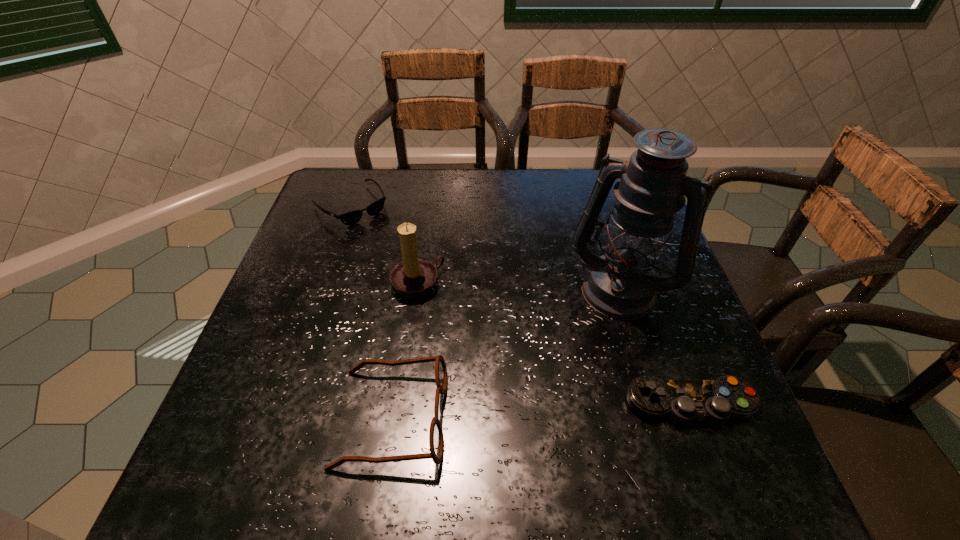
Where is `free space that is in between the control and the spectacles`? free space that is in between the control and the spectacles is located at coordinates (541, 411).

Select which object is the closest to the tallest object. Please provide its 2D coordinates. Your answer should be formatted as a tuple, i.e. [(x, y)], where the tuple contains the x and y coordinates of a point satisfying the conditions above.

[(682, 401)]

Locate which object is the second closest to the lantern. Please provide its 2D coordinates. Your answer should be formatted as a tuple, i.e. [(x, y)], where the tuple contains the x and y coordinates of a point satisfying the conditions above.

[(413, 278)]

Locate an element on the screen. vacant position in the image that satisfies the following two spatial constraints: 1. on the front side of the lantern; 2. on the right side of the leftmost object is located at coordinates (323, 286).